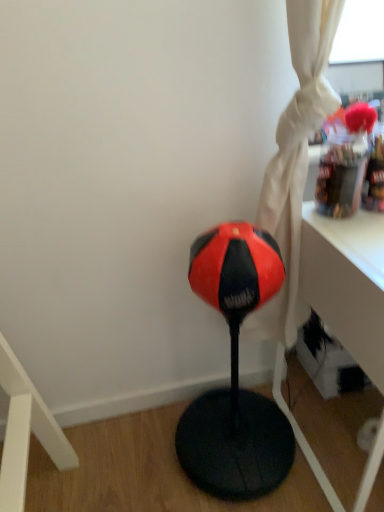
The image size is (384, 512). What do you see at coordinates (347, 282) in the screenshot?
I see `white glossy table at upper right` at bounding box center [347, 282].

Where is `white glossy table at upper right`? The image size is (384, 512). white glossy table at upper right is located at coordinates (347, 282).

The height and width of the screenshot is (512, 384). What are the coordinates of `white glossy table at upper right` in the screenshot? It's located at (347, 282).